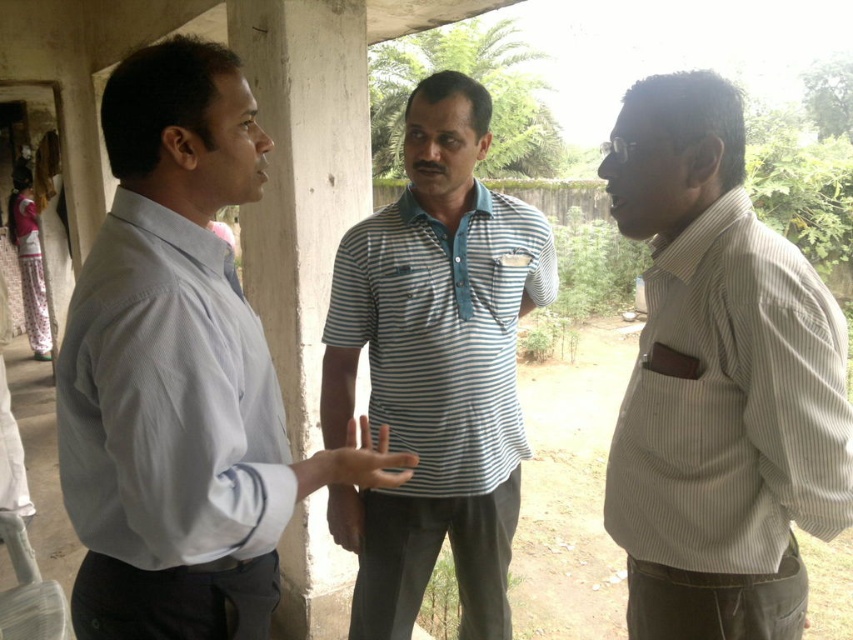
Describe the element at coordinates (434, 369) in the screenshot. I see `blue striped shirt at center` at that location.

Is blue striped shirt at center to the right of light blue striped polo shirt at center from the viewer's perspective?

Indeed, blue striped shirt at center is positioned on the right side of light blue striped polo shirt at center.

Who is more forward, (543, 220) or (265, 371)?

Point (265, 371) is more forward.

Identify the location of blue striped shirt at center. Image resolution: width=853 pixels, height=640 pixels. (434, 369).

Can you confirm if white striped shirt at right is positioned below blue striped shirt at center?

No.

Can you confirm if white striped shirt at right is bigger than blue striped shirt at center?

No.

What do you see at coordinates (718, 381) in the screenshot? I see `white striped shirt at right` at bounding box center [718, 381].

Where is `white striped shirt at right`? The image size is (853, 640). white striped shirt at right is located at coordinates (718, 381).

Can you confirm if white striped shirt at right is bigger than light blue striped polo shirt at center?

Yes.

Is white striped shirt at right closer to camera compared to light blue striped polo shirt at center?

No, it is behind light blue striped polo shirt at center.

Is point (614, 202) closer to viewer compared to point (231, 401)?

That is False.

The height and width of the screenshot is (640, 853). I want to click on white striped shirt at right, so click(718, 381).